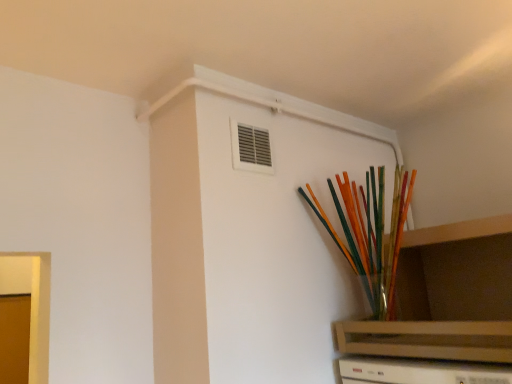
Question: Should I look upward or downward to see clear glass vase at upper right?

Choices:
 (A) up
 (B) down

Answer: (B)

Question: Can you confirm if clear glass vase at upper right is wider than translucent glass vase at upper right?

Choices:
 (A) no
 (B) yes

Answer: (B)

Question: Can translucent glass vase at upper right be found inside clear glass vase at upper right?

Choices:
 (A) yes
 (B) no

Answer: (A)

Question: Is clear glass vase at upper right not inside translucent glass vase at upper right?

Choices:
 (A) yes
 (B) no

Answer: (B)

Question: Is clear glass vase at upper right further to camera compared to translucent glass vase at upper right?

Choices:
 (A) yes
 (B) no

Answer: (B)

Question: Can you confirm if clear glass vase at upper right is smaller than translucent glass vase at upper right?

Choices:
 (A) yes
 (B) no

Answer: (B)

Question: Can you confirm if clear glass vase at upper right is taller than translucent glass vase at upper right?

Choices:
 (A) yes
 (B) no

Answer: (B)

Question: Is translucent glass vase at upper right smaller than clear glass vase at upper right?

Choices:
 (A) no
 (B) yes

Answer: (B)

Question: Are translucent glass vase at upper right and clear glass vase at upper right far apart?

Choices:
 (A) yes
 (B) no

Answer: (B)

Question: Considering the relative sizes of translucent glass vase at upper right and clear glass vase at upper right in the image provided, is translucent glass vase at upper right thinner than clear glass vase at upper right?

Choices:
 (A) yes
 (B) no

Answer: (A)

Question: Can you confirm if translucent glass vase at upper right is positioned to the right of clear glass vase at upper right?

Choices:
 (A) yes
 (B) no

Answer: (B)

Question: Is translucent glass vase at upper right to the left of clear glass vase at upper right from the viewer's perspective?

Choices:
 (A) yes
 (B) no

Answer: (A)

Question: Considering the relative sizes of translucent glass vase at upper right and clear glass vase at upper right in the image provided, is translucent glass vase at upper right bigger than clear glass vase at upper right?

Choices:
 (A) no
 (B) yes

Answer: (A)

Question: Is clear glass vase at upper right taller or shorter than translucent glass vase at upper right?

Choices:
 (A) tall
 (B) short

Answer: (B)